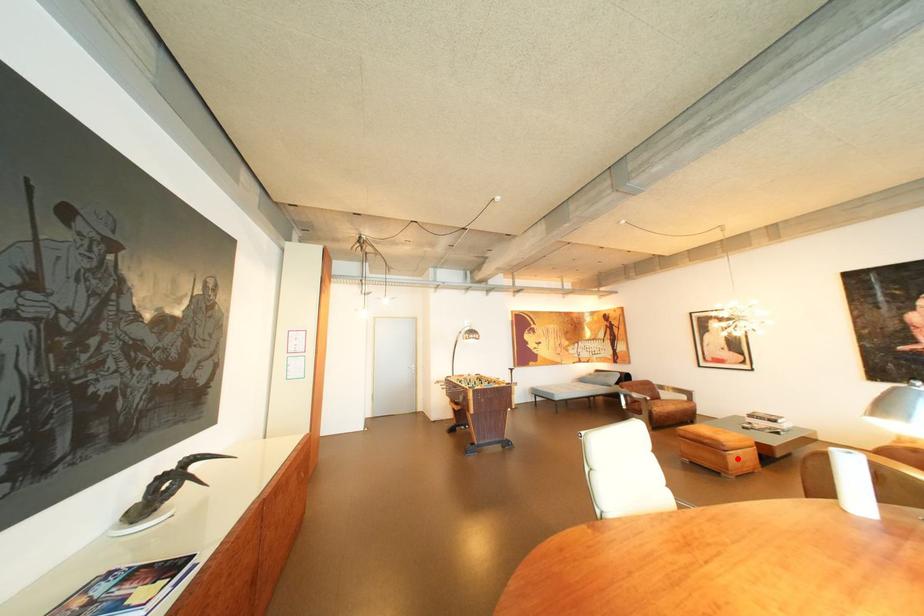
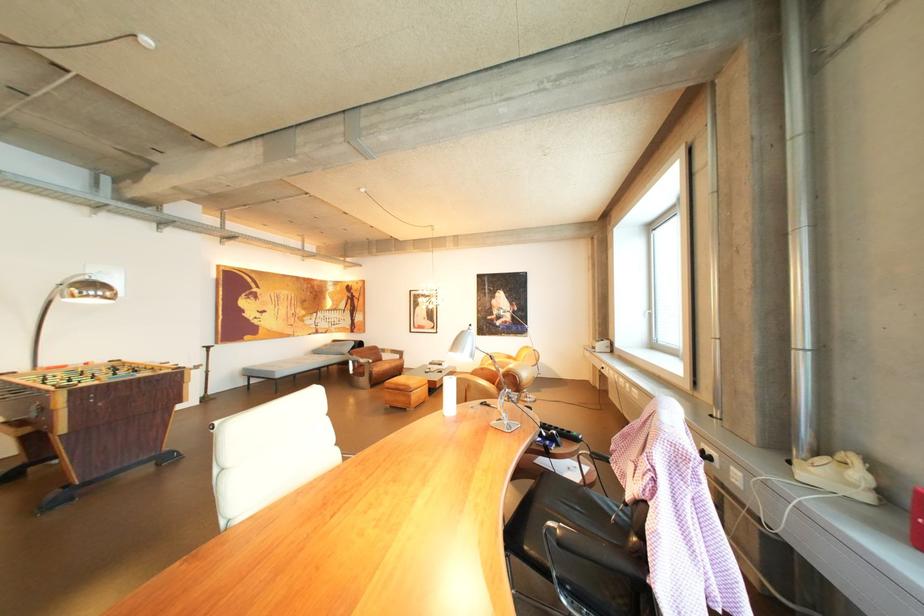
The point at the highlighted location is marked in the first image. Where is the corresponding point in the second image?

(422, 398)